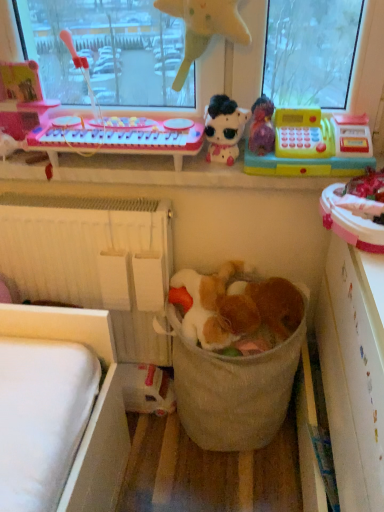
Where is `free point above pink plastic keyboard at upper left (from a real-world perspective)`? This screenshot has width=384, height=512. free point above pink plastic keyboard at upper left (from a real-world perspective) is located at coordinates (121, 120).